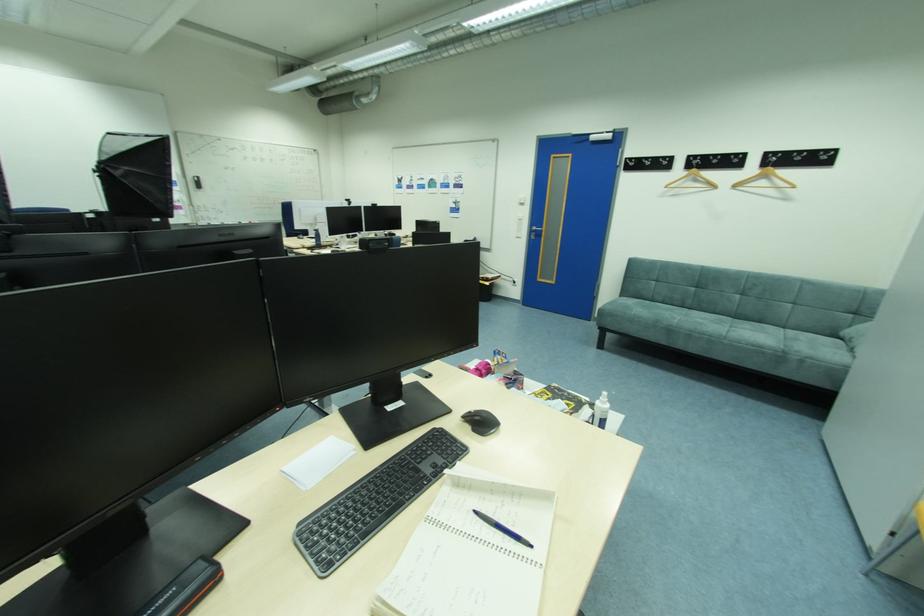
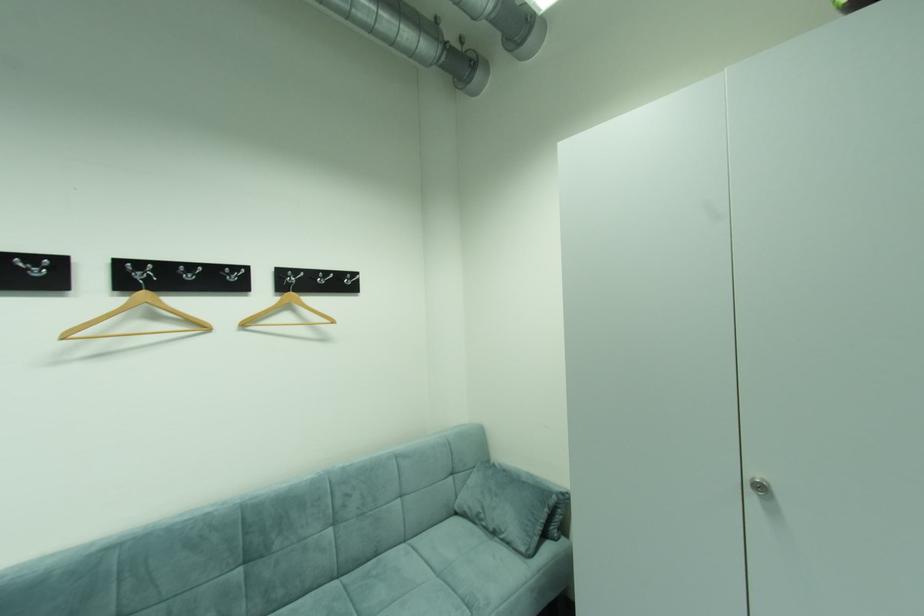
Find the pixel in the second image that matches pixel 711 159 in the first image.

(172, 268)